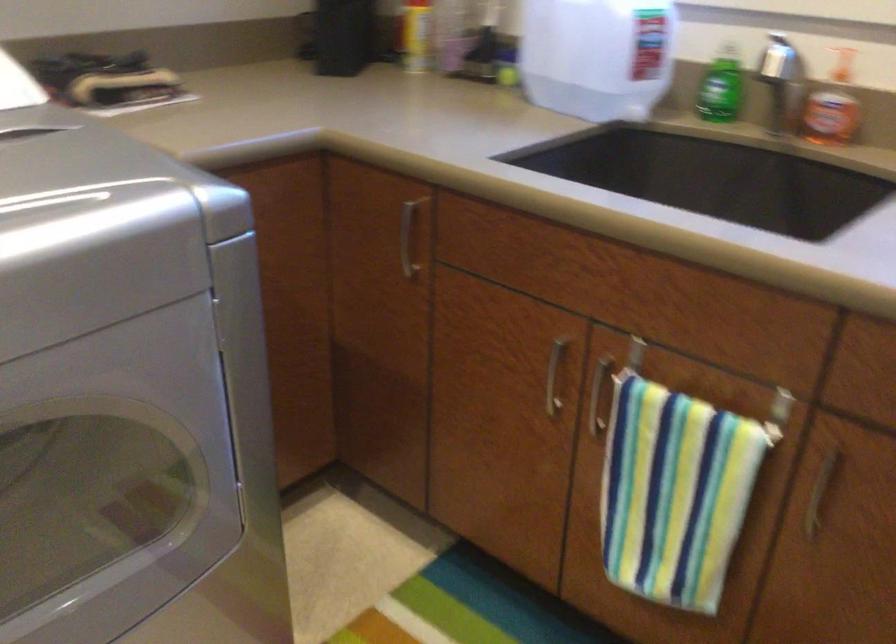
The height and width of the screenshot is (644, 896). In order to click on washing machine lid in this screenshot , I will do `click(73, 155)`.